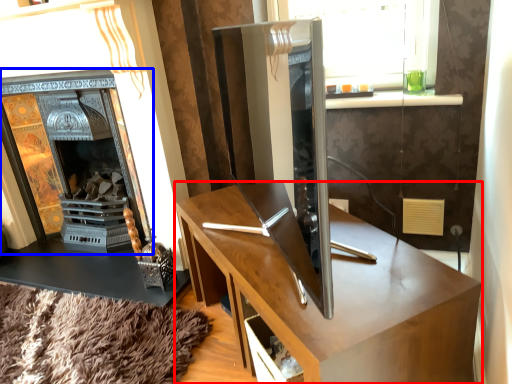
Question: Among these objects, which one is farthest to the camera, desk (highlighted by a red box) or fireplace (highlighted by a blue box)?

Choices:
 (A) desk
 (B) fireplace

Answer: (B)